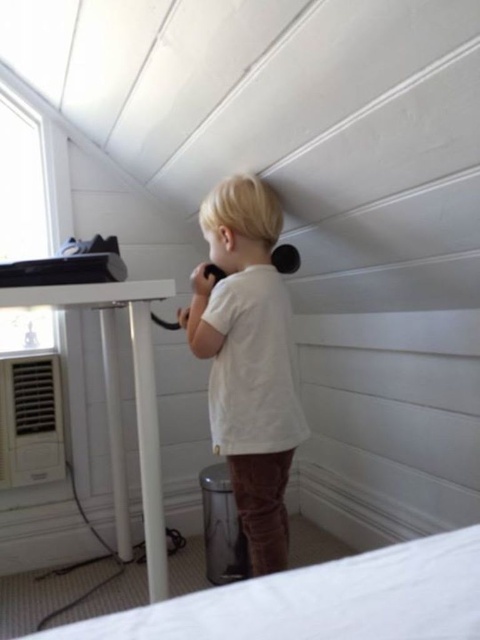
Does point (269, 321) come behind point (396, 630)?

Yes, it is behind point (396, 630).

Is point (283, 481) closer to viewer compared to point (476, 624)?

No, (283, 481) is further to viewer.

Find the location of a particular element. This screenshot has height=640, width=480. white cotton shirt at center is located at coordinates click(248, 358).